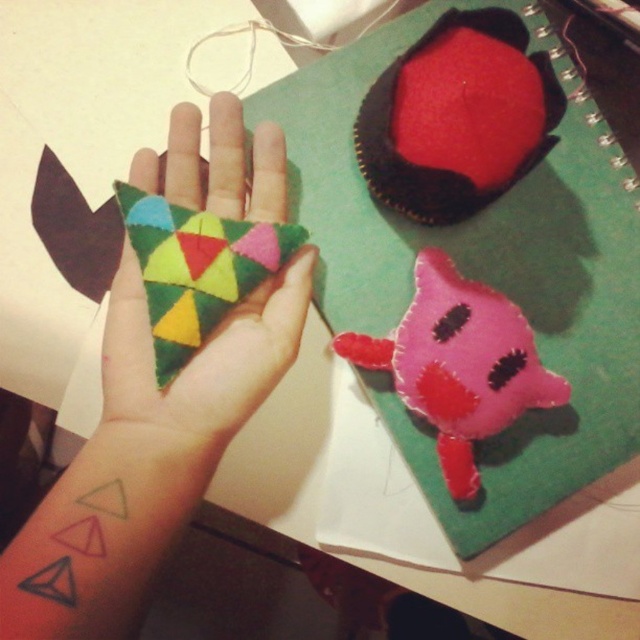
You are an art student who wants to arrange the multicolored felt triangle at center and the pink felt plushie at center on a display board. According to the image, which object should you place higher up to maintain the original arrangement?

The multicolored felt triangle at center should be placed higher up since it is located above the pink felt plushie at center in the image.

You are trying to decide which felt craft to place on a shelf that can only hold items up to 10 cm in height. The multicolored felt triangle at center and the pink felt plushie at center are both candidates. Based on their heights, which one is more likely to fit on the shelf?

The multicolored felt triangle at center is taller than the pink felt plushie at center, so the pink felt plushie at center is more likely to fit on the shelf since it is shorter.

You are an artist trying to place the felt triangle at center onto the notebook cover. According to the image, where exactly should you position it?

The felt triangle at center should be positioned at point (145, 460) as per the coordinates provided in the Objects Description.